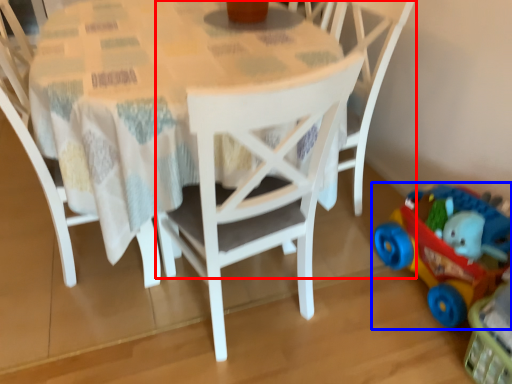
Question: Which of the following is the closest to the observer, chair (highlighted by a red box) or toy (highlighted by a blue box)?

Choices:
 (A) chair
 (B) toy

Answer: (B)